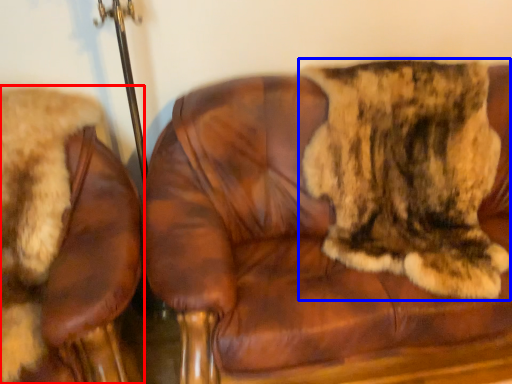
Question: Which object is further to the camera taking this photo, chair (highlighted by a red box) or cat (highlighted by a blue box)?

Choices:
 (A) chair
 (B) cat

Answer: (B)